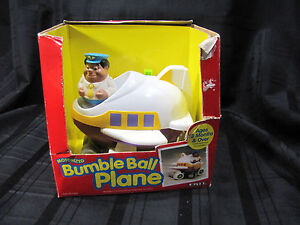
Where is `picture`? The image size is (300, 225). picture is located at coordinates (172, 158).